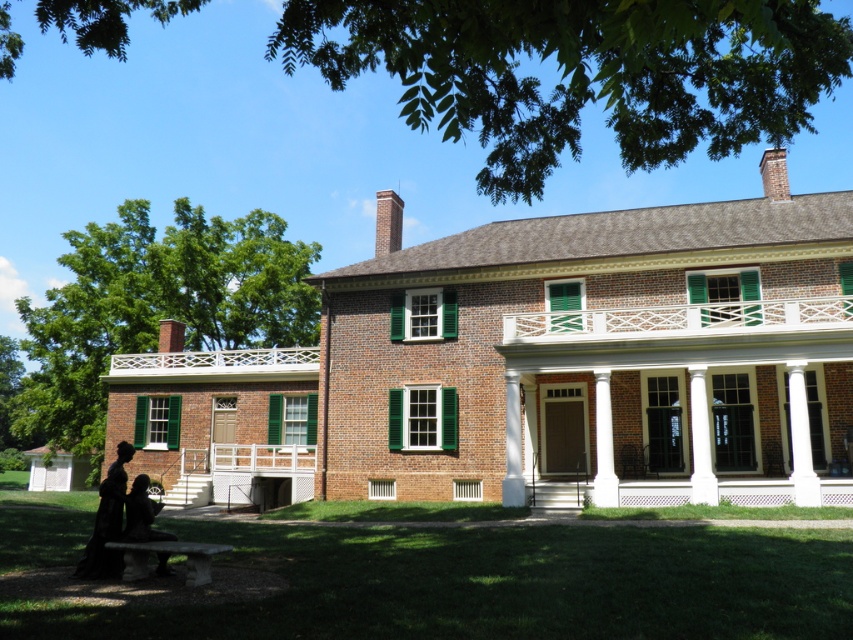
Question: Does brick house at center have a smaller size compared to stone bench at lower left?

Choices:
 (A) no
 (B) yes

Answer: (A)

Question: Is white lattice porch at center closer to camera compared to dark brown fur at lower left?

Choices:
 (A) no
 (B) yes

Answer: (A)

Question: Estimate the real-world distances between objects in this image. Which object is closer to the white painted wood porch at upper center?

Choices:
 (A) dark brown fur at lower left
 (B) black velvet dress at lower left
 (C) brick house at center

Answer: (C)

Question: Which object appears farthest from the camera in this image?

Choices:
 (A) stone bench at lower left
 (B) brick house at center
 (C) dark brown fur at lower left
 (D) white lattice porch at center

Answer: (B)

Question: Which point is farther to the camera?

Choices:
 (A) (752, 310)
 (B) (691, 483)
 (C) (122, 440)

Answer: (C)

Question: Is black velvet dress at lower left thinner than dark brown fur at lower left?

Choices:
 (A) yes
 (B) no

Answer: (B)